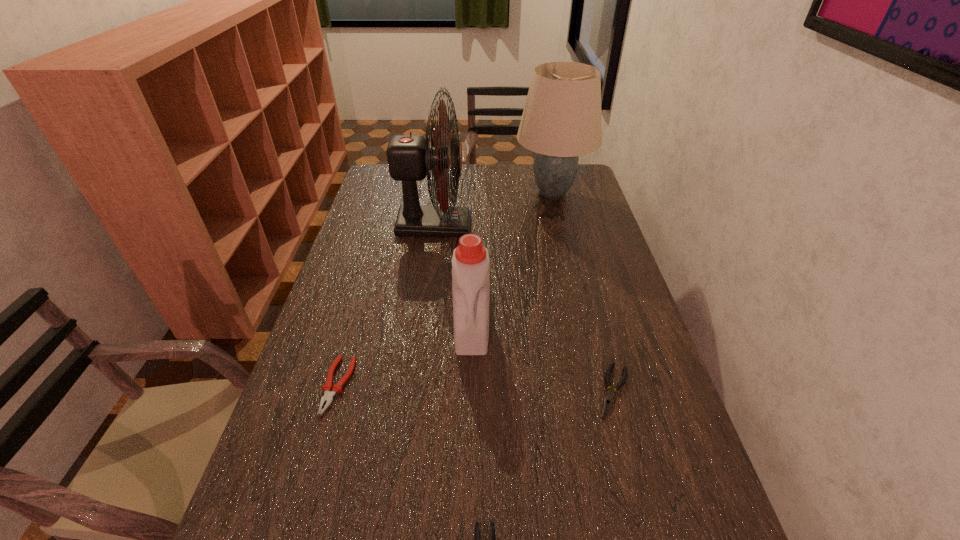
Find the location of a particular element. This screenshot has width=960, height=540. fan is located at coordinates (410, 157).

Identify the location of lampshade. (561, 120).

The height and width of the screenshot is (540, 960). Find the location of `detergent`. detergent is located at coordinates (470, 263).

The height and width of the screenshot is (540, 960). What are the coordinates of `the leftmost pliers` in the screenshot? It's located at (328, 396).

This screenshot has height=540, width=960. I want to click on the rightmost pliers, so click(x=608, y=400).

In order to click on vacant space located on the front-facing side of the fan in this screenshot , I will do `click(533, 225)`.

The width and height of the screenshot is (960, 540). I want to click on vacant space located 0.290m on the left of the lampshade, so click(439, 193).

The height and width of the screenshot is (540, 960). Identify the location of vacant space situated 0.230m on the handle side of the fourth shortest object. (469, 443).

Where is `free location located 0.210m on the back of the leftmost pliers`? free location located 0.210m on the back of the leftmost pliers is located at coordinates (362, 299).

Image resolution: width=960 pixels, height=540 pixels. I want to click on vacant space situated 0.280m on the left of the rightmost pliers, so click(475, 391).